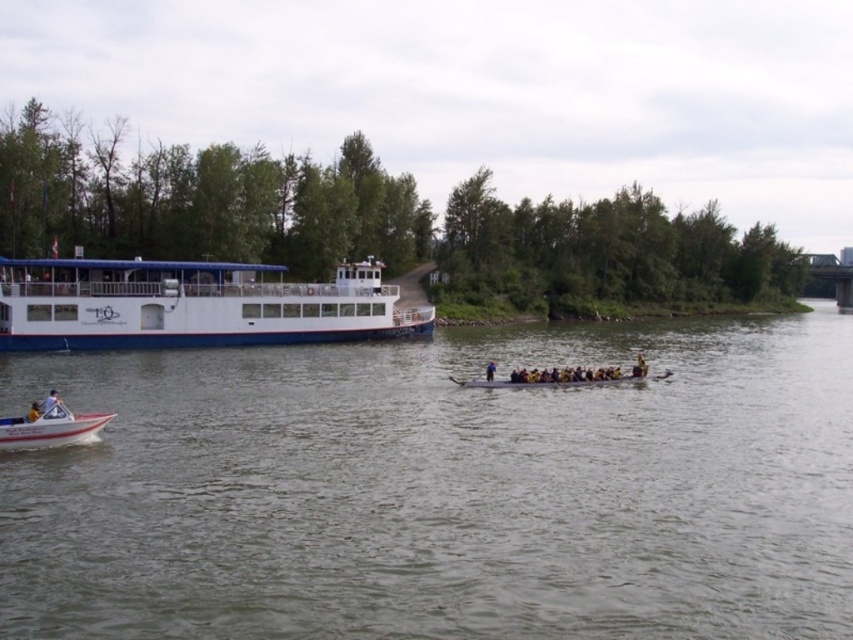
You are a photographer trying to capture a closeup of the yellow fabric person at lower left and the white plastic motorboat at lower left. Since you want both subjects to be in focus, which one should you focus on first?

The white plastic motorboat at lower left is smaller than the yellow fabric person at lower left, so you should focus on the yellow fabric person at lower left first to ensure both are in focus.

You are standing on the large white and blue ferry boat with multiple decks and want to see the dragon boat in the center. From your position on the ferry, which direction should you look to see the dragon boat first? Is it towards the point at coordinate point (134, 262) or point (51, 397)?

You should look towards point (51, 397) to see the dragon boat first because point (134, 262) is behind it.